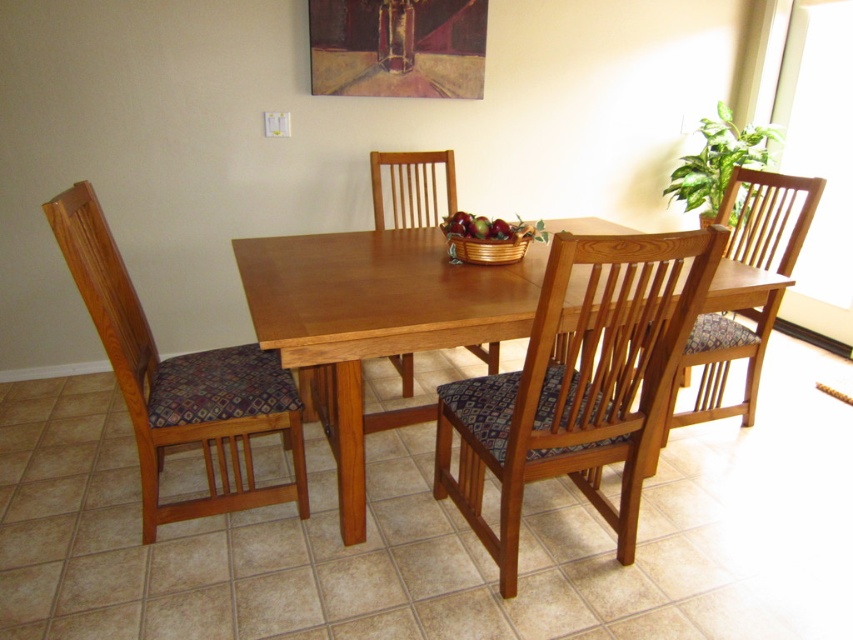
Question: Can you confirm if wooden chair with patterned cushion at left is positioned below shiny red apples at center?

Choices:
 (A) yes
 (B) no

Answer: (A)

Question: Does wooden chair with patterned cushion at center have a smaller size compared to shiny red apples at center?

Choices:
 (A) no
 (B) yes

Answer: (A)

Question: Which object is farther from the camera taking this photo?

Choices:
 (A) oil paint canvas at upper center
 (B) wooden chair with patterned cushion at center
 (C) wooden chair with patterned cushion at left
 (D) wooden chair with patterned cushion at right

Answer: (A)

Question: Which of the following is the farthest from the observer?

Choices:
 (A) oil paint canvas at upper center
 (B) light brown wood table at center
 (C) shiny red apples at center
 (D) wooden chair with patterned cushion at right

Answer: (A)

Question: Among these objects, which one is farthest from the camera?

Choices:
 (A) wooden chair with patterned cushion at left
 (B) wooden chair with patterned cushion at center
 (C) shiny red apples at center

Answer: (C)

Question: Does wooden chair with patterned cushion at center have a larger size compared to wooden chair with patterned cushion at right?

Choices:
 (A) no
 (B) yes

Answer: (A)